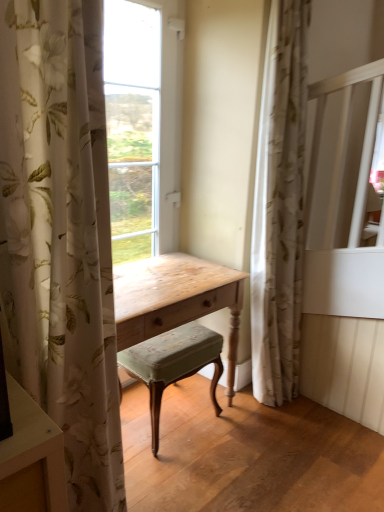
Locate an element on the screen. The width and height of the screenshot is (384, 512). free spot to the right of velvet green cushioned stool at center is located at coordinates (251, 433).